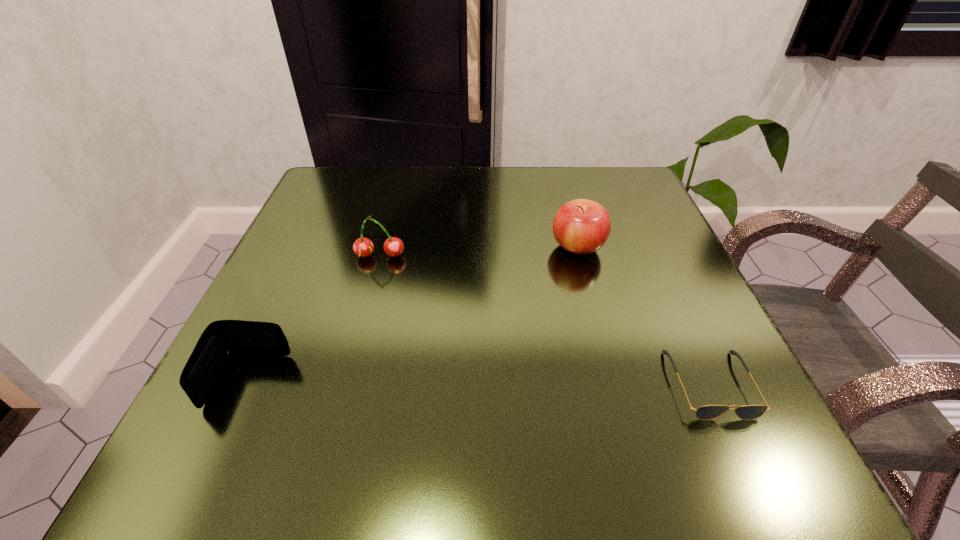
Find the location of a particular element. vacant space at the far right corner of the desktop is located at coordinates (634, 190).

This screenshot has width=960, height=540. What are the coordinates of `free space that is in between the rightmost object and the leftmost object` in the screenshot? It's located at (479, 382).

Identify the location of vacant area that lies between the third object from right to left and the wallet. (314, 318).

I want to click on vacant region between the apple and the second shortest object, so click(413, 314).

At what (x,y) coordinates should I click in order to perform the action: click on vacant area that lies between the second object from right to left and the third object from right to left. Please return your answer as a coordinate pair (x, y). This screenshot has width=960, height=540. Looking at the image, I should click on (479, 252).

At what (x,y) coordinates should I click in order to perform the action: click on empty space that is in between the third tallest object and the cherry. Please return your answer as a coordinate pair (x, y). The height and width of the screenshot is (540, 960). Looking at the image, I should click on (314, 318).

What are the coordinates of `vacant space in between the sunglasses and the wallet` in the screenshot? It's located at (479, 382).

This screenshot has width=960, height=540. Find the location of `vacant space that's between the cherry and the rightmost object`. vacant space that's between the cherry and the rightmost object is located at coordinates (545, 320).

Locate an element on the screen. The image size is (960, 540). free space that is in between the shortest object and the apple is located at coordinates (644, 315).

Where is `unoccupied area between the leftmost object and the cherry`? unoccupied area between the leftmost object and the cherry is located at coordinates (314, 318).